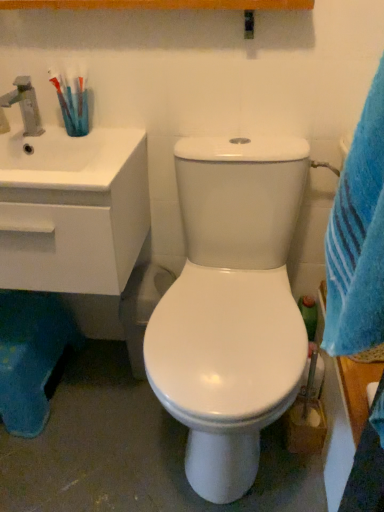
Question: Is matte silver faucet at upper left turned away from translucent plastic toothbrush at upper left?

Choices:
 (A) no
 (B) yes

Answer: (A)

Question: Can you confirm if matte silver faucet at upper left is positioned to the right of translucent plastic toothbrush at upper left?

Choices:
 (A) no
 (B) yes

Answer: (A)

Question: Is matte silver faucet at upper left oriented towards translucent plastic toothbrush at upper left?

Choices:
 (A) yes
 (B) no

Answer: (B)

Question: Is matte silver faucet at upper left to the left of translucent plastic toothbrush at upper left from the viewer's perspective?

Choices:
 (A) yes
 (B) no

Answer: (A)

Question: Considering the relative sizes of matte silver faucet at upper left and translucent plastic toothbrush at upper left in the image provided, is matte silver faucet at upper left shorter than translucent plastic toothbrush at upper left?

Choices:
 (A) no
 (B) yes

Answer: (B)

Question: Can you see matte silver faucet at upper left touching translucent plastic toothbrush at upper left?

Choices:
 (A) yes
 (B) no

Answer: (B)

Question: Considering the relative sizes of translucent plastic toothbrush at upper left and matte silver faucet at upper left in the image provided, is translucent plastic toothbrush at upper left wider than matte silver faucet at upper left?

Choices:
 (A) yes
 (B) no

Answer: (B)

Question: Is translucent plastic toothbrush at upper left behind matte silver faucet at upper left?

Choices:
 (A) yes
 (B) no

Answer: (A)

Question: From a real-world perspective, is translucent plastic toothbrush at upper left located higher than matte silver faucet at upper left?

Choices:
 (A) yes
 (B) no

Answer: (A)

Question: Does translucent plastic toothbrush at upper left have a smaller size compared to matte silver faucet at upper left?

Choices:
 (A) yes
 (B) no

Answer: (A)

Question: From a real-world perspective, is translucent plastic toothbrush at upper left located beneath matte silver faucet at upper left?

Choices:
 (A) no
 (B) yes

Answer: (A)

Question: Is translucent plastic toothbrush at upper left to the left of matte silver faucet at upper left from the viewer's perspective?

Choices:
 (A) no
 (B) yes

Answer: (A)

Question: Is white glossy sink at left to the left of blue plush rug at lower left from the viewer's perspective?

Choices:
 (A) yes
 (B) no

Answer: (B)